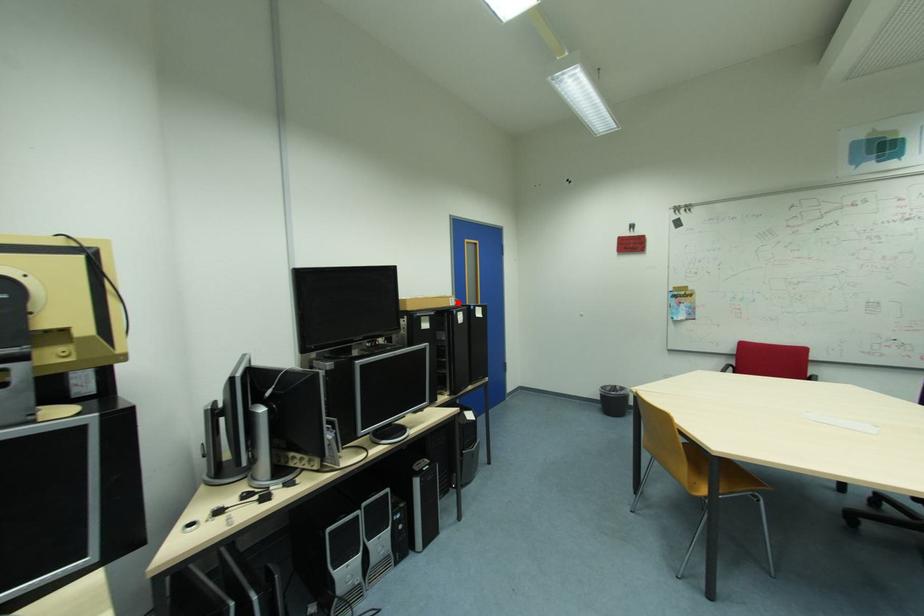
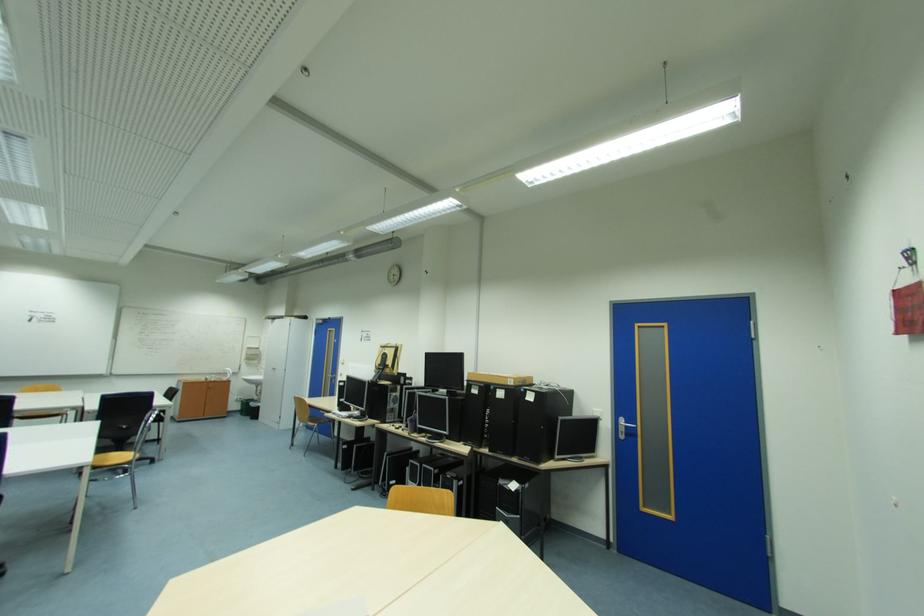
Question: I am providing you with two images of the same scene from different viewpoints. A red point is marked on the first image. At the location where the point appears in image 1, is it still visible in image 2?

Choices:
 (A) Yes
 (B) No

Answer: (A)